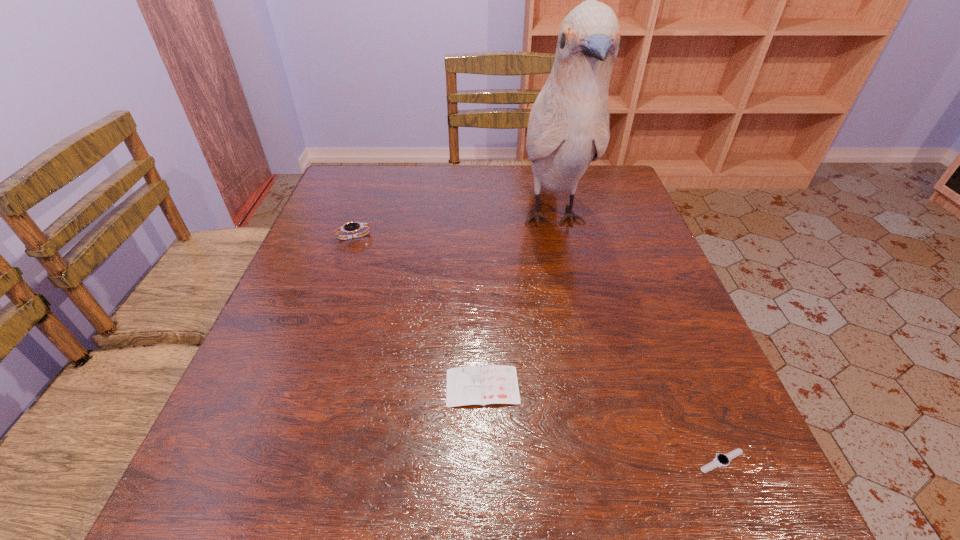
You are a GUI agent. You are given a task and a screenshot of the screen. Output one action in this format:
    pyautogui.click(x=<x>, y=<y>)
    Task: Click on the vacant position located 0.350m on the back of the third farthest object
    
    Given the screenshot: What is the action you would take?
    pyautogui.click(x=482, y=249)

You are a GUI agent. You are given a task and a screenshot of the screen. Output one action in this format:
    pyautogui.click(x=<x>, y=<y>)
    Task: Click on the vacant region located on the back of the shortest object
    This screenshot has width=960, height=540.
    Given the screenshot: What is the action you would take?
    pyautogui.click(x=679, y=357)

Locate an element on the screen. object situated at the far edge is located at coordinates [x=568, y=128].

The width and height of the screenshot is (960, 540). What are the coordinates of `object at the near edge` in the screenshot? It's located at (721, 460).

Locate an element on the screen. object located in the left edge section of the desktop is located at coordinates (351, 227).

Locate an element on the screen. The width and height of the screenshot is (960, 540). parakeet present at the right edge is located at coordinates (568, 128).

Where is `watch located in the right edge section of the desktop`? The width and height of the screenshot is (960, 540). watch located in the right edge section of the desktop is located at coordinates (721, 460).

Where is `object positioned at the far right corner`? This screenshot has height=540, width=960. object positioned at the far right corner is located at coordinates (568, 128).

Where is `object present at the near right corner`? The width and height of the screenshot is (960, 540). object present at the near right corner is located at coordinates (721, 460).

In the image, there is a desktop. Where is `vacant space at the far edge`? vacant space at the far edge is located at coordinates (450, 168).